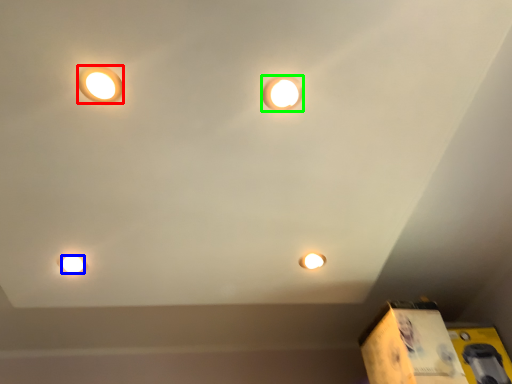
Question: Based on their relative distances, which object is nearer to lamp (highlighted by a red box)? Choose from light bulb (highlighted by a blue box) and lamp (highlighted by a green box).

Choices:
 (A) light bulb
 (B) lamp

Answer: (B)